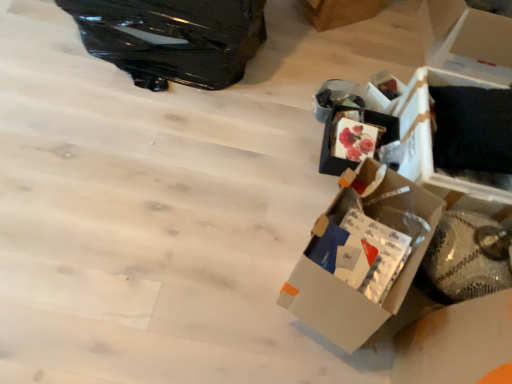
Identify the location of empty space that is in between white cardboard box at upper right, placed as the second cardboard box when sorted from right to left, and white cardboard box at upper right, arranged as the second storage box when viewed from the front. (360, 48).